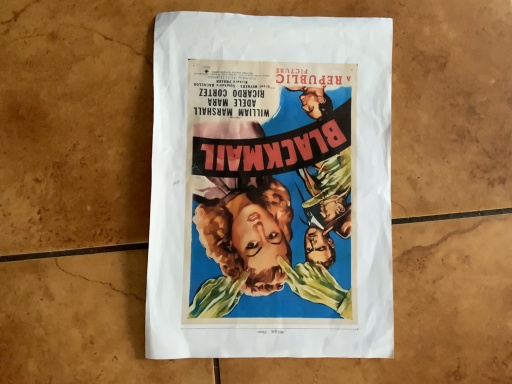
This screenshot has height=384, width=512. What are the coordinates of `empty space that is ontop of vibrant paper poster at center (from a real-world perspective)` in the screenshot? It's located at (271, 181).